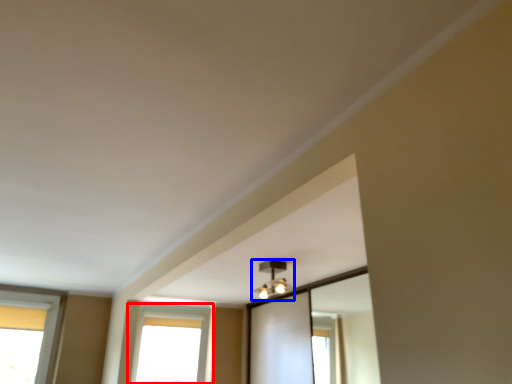
Question: Which of the following is the closest to the observer, window (highlighted by a red box) or light fixture (highlighted by a blue box)?

Choices:
 (A) window
 (B) light fixture

Answer: (B)